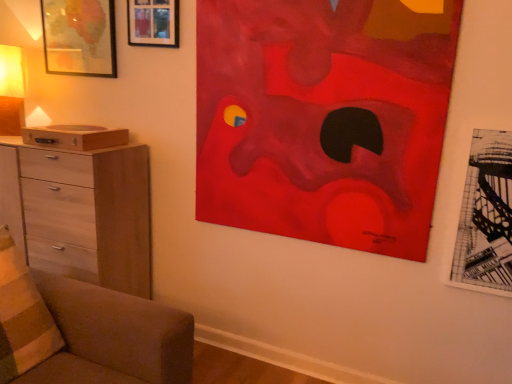
Question: Is striped fabric pillow at lower left bigger or smaller than matte yellow fabric at left?

Choices:
 (A) small
 (B) big

Answer: (A)

Question: Which is correct: striped fabric pillow at lower left is inside matte yellow fabric at left, or outside of it?

Choices:
 (A) outside
 (B) inside

Answer: (A)

Question: Estimate the real-world distances between objects in this image. Which object is farther from the matte yellow fabric at left?

Choices:
 (A) matte red abstract painting at upper right
 (B) brown fabric couch at lower left
 (C) wooden picture frame at upper left, which is the 2th picture frame in back-to-front order
 (D) light wood chest of drawers at left
 (E) striped fabric pillow at lower left

Answer: (A)

Question: Which object is positioned closest to the light wood chest of drawers at left?

Choices:
 (A) black paper picture frame at right, placed as the third picture frame when sorted from top to bottom
 (B) wooden picture frame at upper left, positioned as the 2th picture frame in right-to-left order
 (C) matte red abstract painting at upper right
 (D) brown fabric couch at lower left
 (E) striped fabric pillow at lower left

Answer: (D)